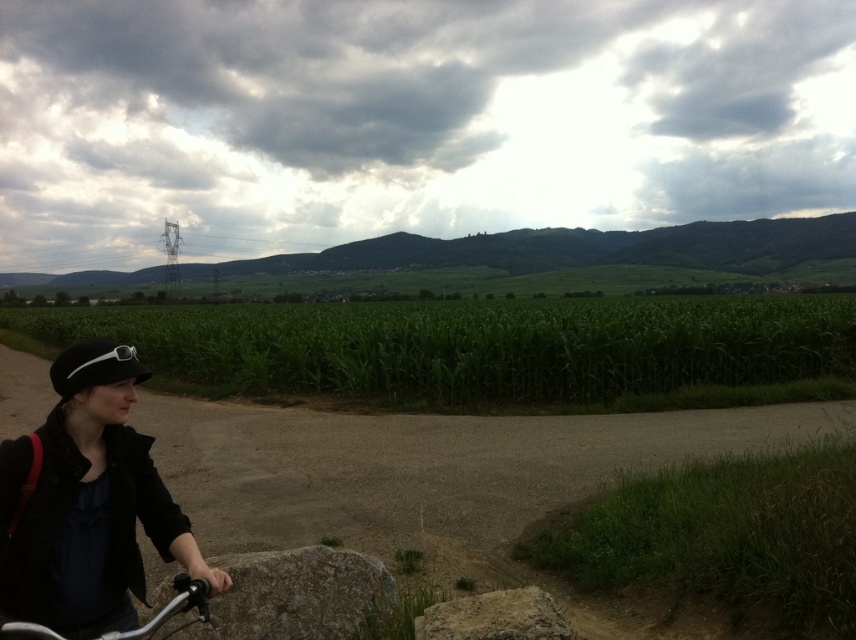
Is green leafy corn at center to the left of rough textured rock at lower center from the viewer's perspective?

In fact, green leafy corn at center is to the right of rough textured rock at lower center.

Can you confirm if green leafy corn at center is thinner than rough textured rock at lower center?

Incorrect, green leafy corn at center's width is not less than rough textured rock at lower center's.

Find the location of a particular element. This screenshot has height=640, width=856. green leafy corn at center is located at coordinates (488, 348).

Between green leafy corn at center and black matte jacket at lower left, which one has less height?

Standing shorter between the two is black matte jacket at lower left.

Is green leafy corn at center wider than black matte jacket at lower left?

Indeed, green leafy corn at center has a greater width compared to black matte jacket at lower left.

Where is `green leafy corn at center`? green leafy corn at center is located at coordinates (488, 348).

Who is higher up, brown gravel dirt track at lower left or green leafy corn at center?

Positioned higher is green leafy corn at center.

Can you confirm if brown gravel dirt track at lower left is smaller than green leafy corn at center?

Yes, brown gravel dirt track at lower left is smaller than green leafy corn at center.

The height and width of the screenshot is (640, 856). Identify the location of brown gravel dirt track at lower left. (437, 477).

Where is `brown gravel dirt track at lower left`? This screenshot has height=640, width=856. brown gravel dirt track at lower left is located at coordinates (437, 477).